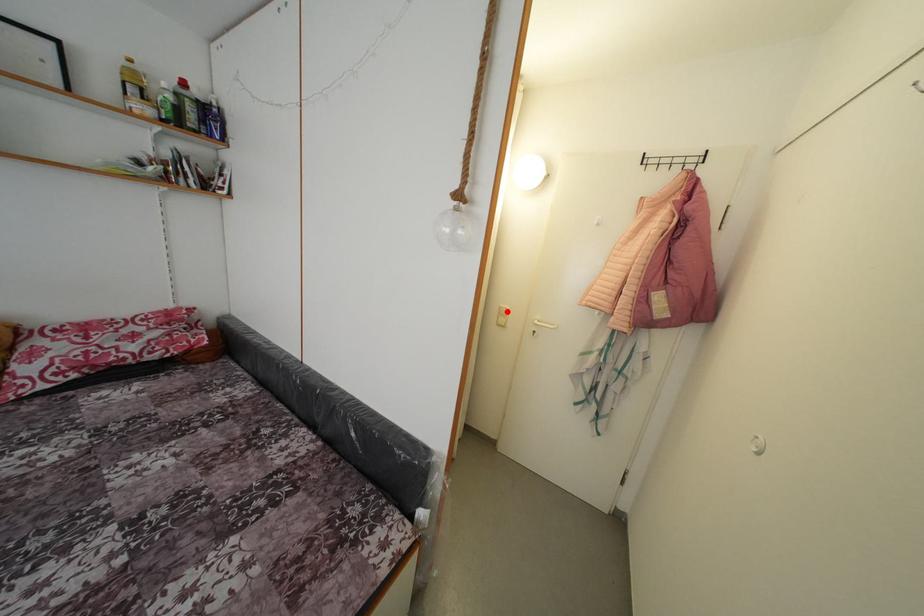
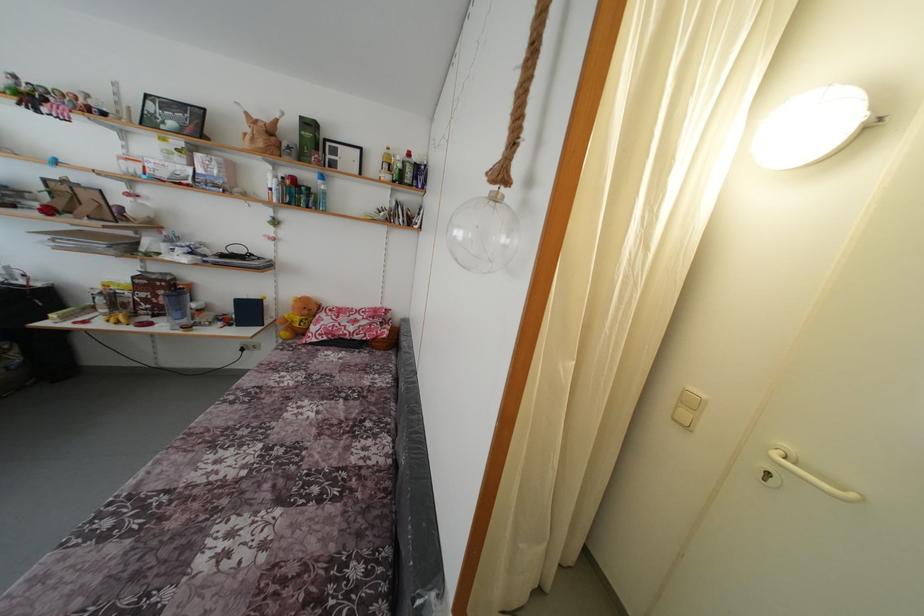
Locate, in the second image, the point that corresponds to the highlighted location in the first image.

(696, 394)